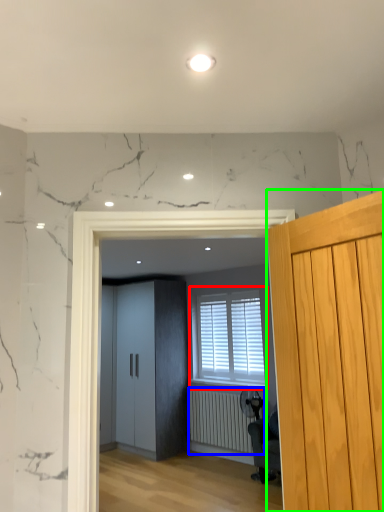
Question: Based on their relative distances, which object is nearer to window (highlighted by a red box)? Choose from radiator (highlighted by a blue box) and door (highlighted by a green box).

Choices:
 (A) radiator
 (B) door

Answer: (A)